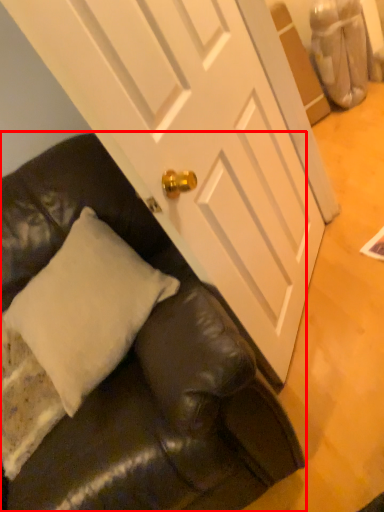
Question: From the image's perspective, where is studio couch (annotated by the red box) located relative to pillow?

Choices:
 (A) below
 (B) above

Answer: (A)